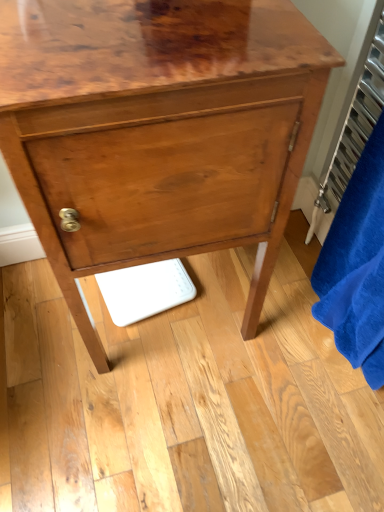
Identify the location of free spot below glossy wood chest of drawers at center (from a real-world perspective). This screenshot has height=512, width=384. (183, 311).